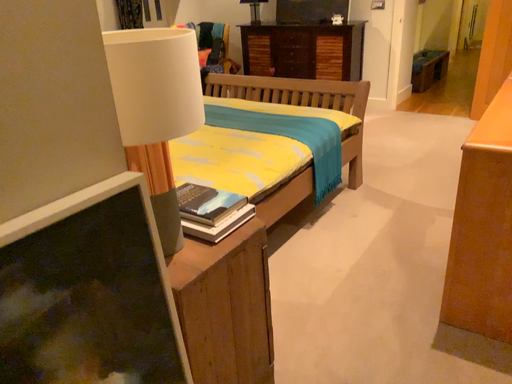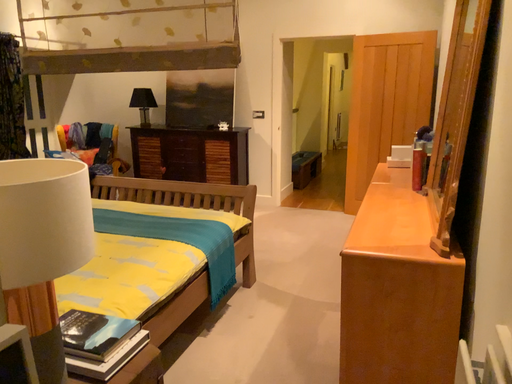
Question: How did the camera likely rotate when shooting the video?

Choices:
 (A) rotated upward
 (B) rotated downward

Answer: (A)